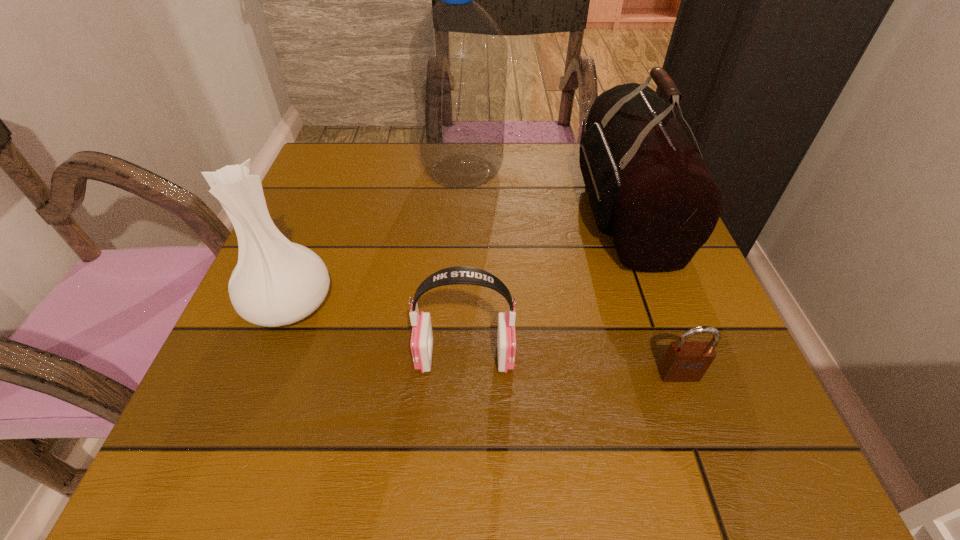
What are the coordinates of `vacant space at the left edge of the desktop` in the screenshot? It's located at (300, 390).

This screenshot has height=540, width=960. I want to click on free space at the right edge, so click(x=661, y=333).

The height and width of the screenshot is (540, 960). I want to click on vacant space at the far left corner of the desktop, so click(309, 175).

Image resolution: width=960 pixels, height=540 pixels. Find the location of `free space at the near right corner`. free space at the near right corner is located at coordinates (778, 480).

You are a GUI agent. You are given a task and a screenshot of the screen. Output one action in this format:
    pyautogui.click(x=<x>, y=<y>)
    Task: Click on the vacant area between the padlock and the duffel bag
    Image resolution: width=960 pixels, height=540 pixels.
    Given the screenshot: What is the action you would take?
    pyautogui.click(x=652, y=293)

Find the location of a particular element. This screenshot has width=960, height=540. vacant space in between the water jug and the earphone is located at coordinates (464, 264).

Locate an element on the screen. Image resolution: width=960 pixels, height=540 pixels. free space between the duffel bag and the tallest object is located at coordinates (543, 191).

You are a GUI agent. You are given a task and a screenshot of the screen. Output one action in this format:
    pyautogui.click(x=<x>, y=<y>)
    Task: Click on the free spot between the padlock and the duffel bag
    The height and width of the screenshot is (540, 960).
    Given the screenshot: What is the action you would take?
    pyautogui.click(x=652, y=293)

Locate an element on the screen. Image resolution: width=960 pixels, height=540 pixels. empty space that is in between the padlock and the fourth tallest object is located at coordinates (572, 366).

The height and width of the screenshot is (540, 960). What are the coordinates of `empty space that is in between the duffel bag and the shortest object` in the screenshot? It's located at (652, 293).